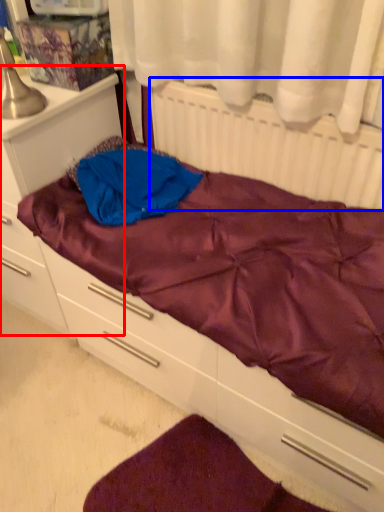
Question: Which object is further to the camera taking this photo, file cabinet (highlighted by a red box) or radiator (highlighted by a blue box)?

Choices:
 (A) file cabinet
 (B) radiator

Answer: (A)